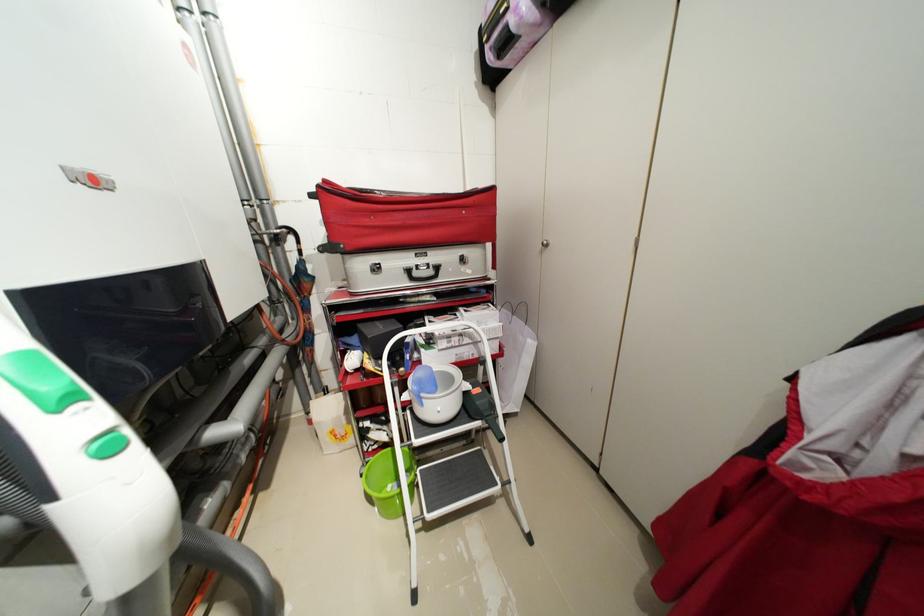
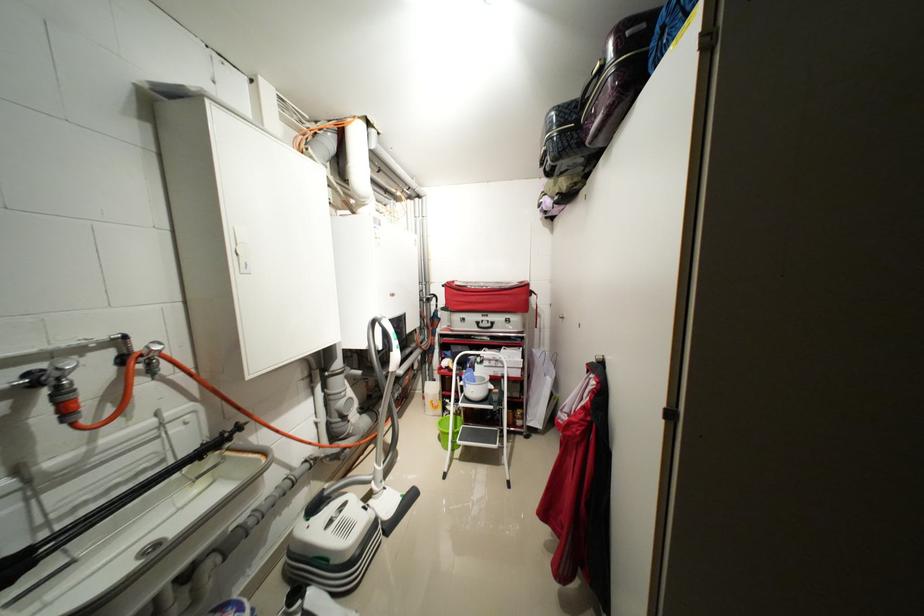
Where in the second image is the point corresponding to [332,182] from the first image?

(455, 284)